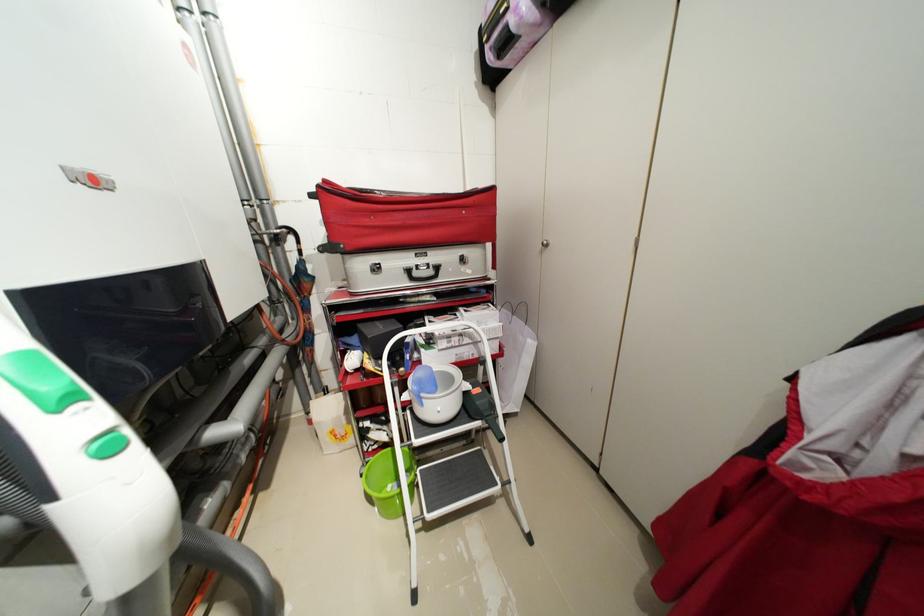
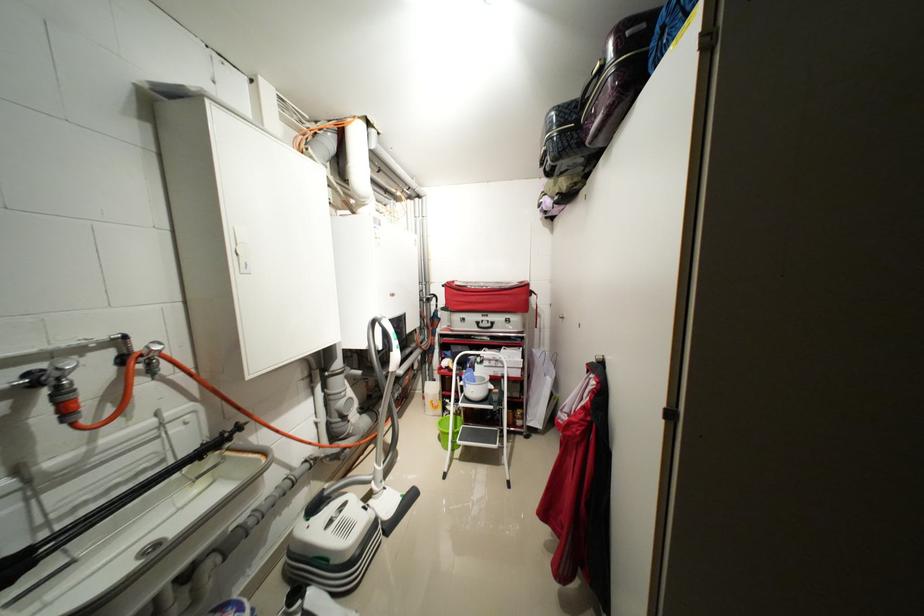
Where in the second image is the point corresponding to [332,182] from the first image?

(455, 284)